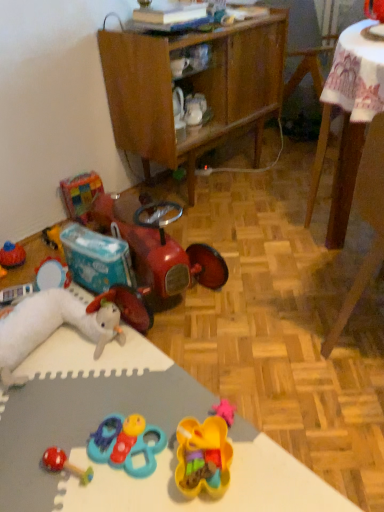
The width and height of the screenshot is (384, 512). Find the location of `vacant space behind translucent plastic container at center, the fifth toy viewed from the left`. vacant space behind translucent plastic container at center, the fifth toy viewed from the left is located at coordinates (182, 398).